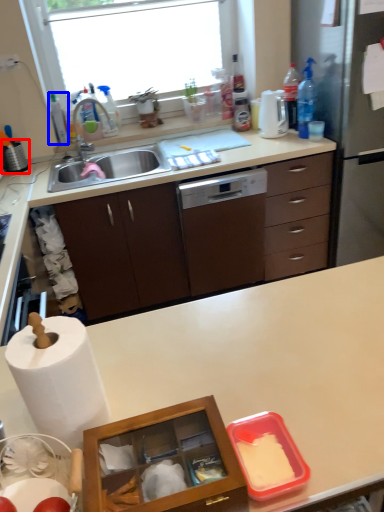
Question: Which point is closer to the camera, appliance (highlighted by a red box) or bottle (highlighted by a blue box)?

Choices:
 (A) appliance
 (B) bottle

Answer: (A)